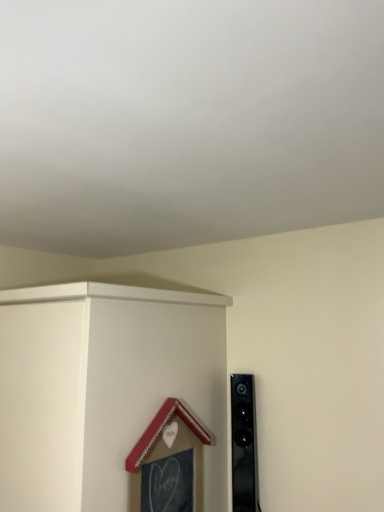
Question: Should I look upward or downward to see wooden heart-shaped frame at upper center?

Choices:
 (A) down
 (B) up

Answer: (A)